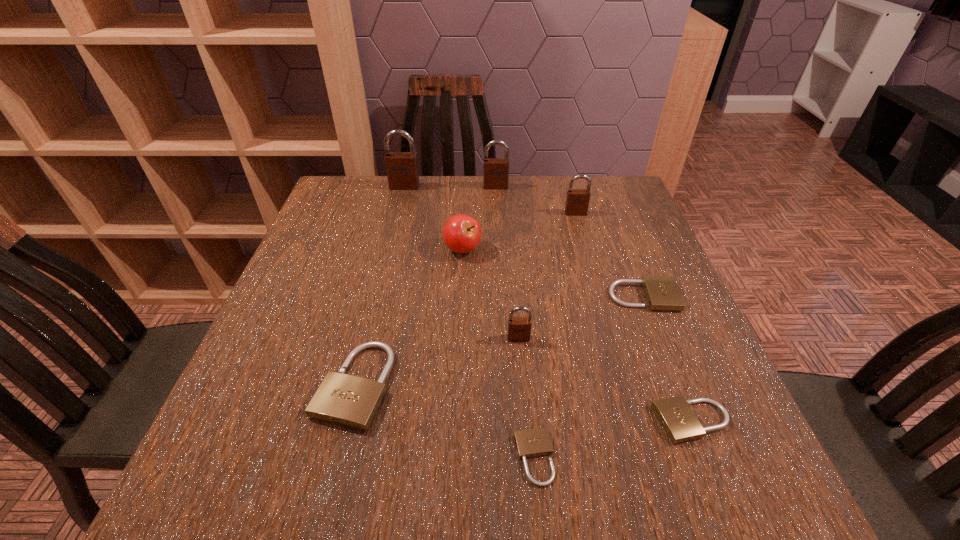
Locate an element on the screen. the closest brown padlock to the third smallest beige padlock is located at coordinates (519, 328).

Locate which brown padlock is the closest to the fifth farthest object. Please provide its 2D coordinates. Your answer should be formatted as a tuple, i.e. [(x, y)], where the tuple contains the x and y coordinates of a point satisfying the conditions above.

[(519, 328)]

Locate an element on the screen. The height and width of the screenshot is (540, 960). beige padlock identified as the closest to the shortest padlock is located at coordinates (676, 416).

Where is `beige padlock that is the closest one to the sixth shortest padlock`? beige padlock that is the closest one to the sixth shortest padlock is located at coordinates (662, 292).

The image size is (960, 540). Identify the location of vacant space that satisfies the following two spatial constraints: 1. on the back side of the biggest beige padlock; 2. on the right side of the second biggest beige padlock. (376, 296).

Identify the location of blank space that satisfies the following two spatial constraints: 1. on the front-facing side of the seventh tallest padlock; 2. on the right side of the tallest padlock. The image size is (960, 540). (348, 421).